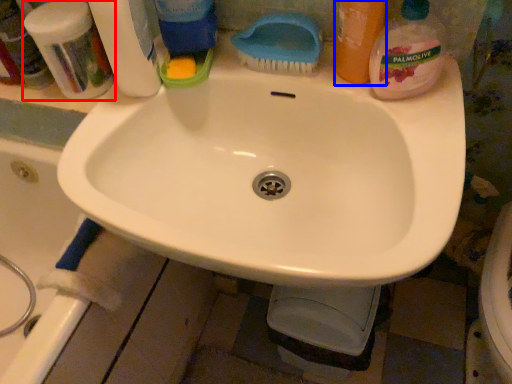
Question: Which object appears closest to the camera in this image, toiletry (highlighted by a red box) or cleaning product (highlighted by a blue box)?

Choices:
 (A) toiletry
 (B) cleaning product

Answer: (B)